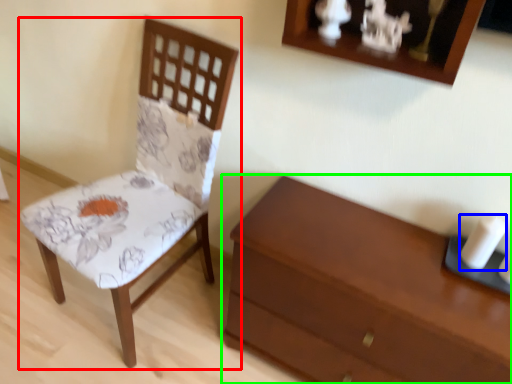
Question: Which object is the farthest from chair (highlighted by a red box)? Choose among these: candle (highlighted by a blue box) or chest of drawers (highlighted by a green box).

Choices:
 (A) candle
 (B) chest of drawers

Answer: (A)